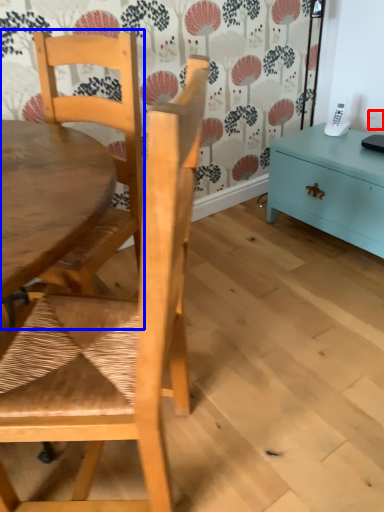
Question: Which of the following is the farthest to the observer, power outlet (highlighted by a red box) or chair (highlighted by a blue box)?

Choices:
 (A) power outlet
 (B) chair

Answer: (A)